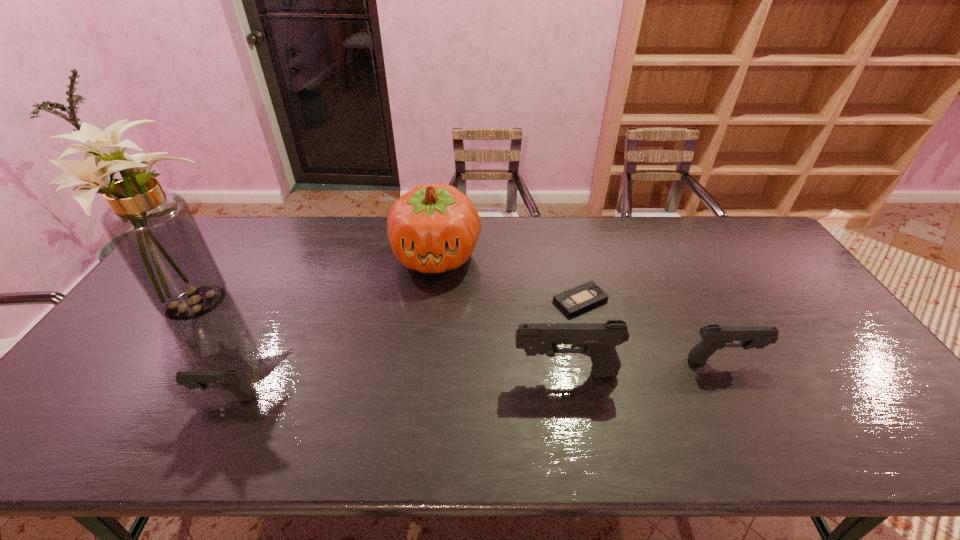
Identify the location of vacant spot for a new pistol to ensure equal spacing. The image size is (960, 540). (399, 385).